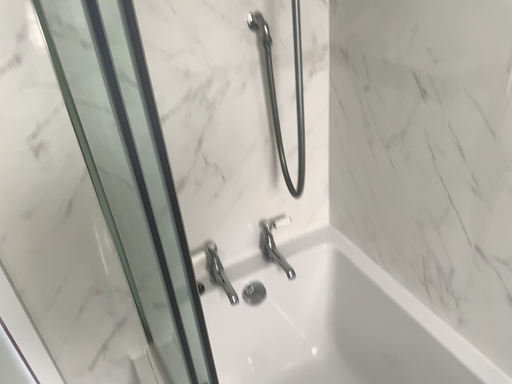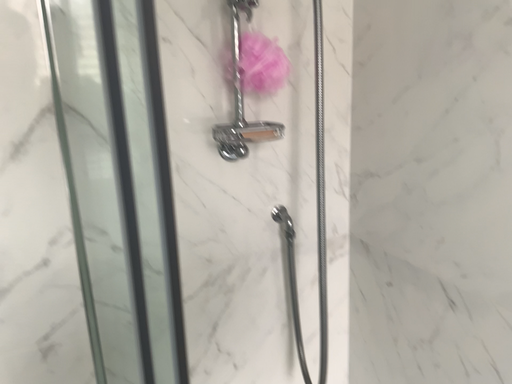
Question: How did the camera likely rotate when shooting the video?

Choices:
 (A) rotated downward
 (B) rotated upward

Answer: (B)